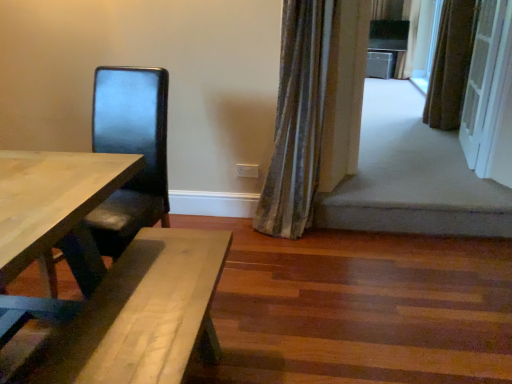
Question: Visually, is velvet-like curtain at upper right, which ranks as the third curtain in top-to-bottom order, positioned to the left or to the right of matte black chair at left?

Choices:
 (A) left
 (B) right

Answer: (B)

Question: In terms of width, does velvet-like curtain at upper right, the 3th curtain positioned from the right, look wider or thinner when compared to matte black chair at left?

Choices:
 (A) wide
 (B) thin

Answer: (B)

Question: Which is nearer to the striped fabric curtain at upper right, which is counted as the 1th curtain, starting from the right?

Choices:
 (A) brown textured curtain at upper right, which is the second curtain from top to bottom
 (B) white textured screen door at upper right
 (C) matte black chair at left
 (D) velvet-like curtain at upper right, acting as the 1th curtain starting from the bottom

Answer: (A)

Question: Based on their relative distances, which object is farther from the white textured screen door at upper right?

Choices:
 (A) striped fabric curtain at upper right, the 3th curtain when ordered from front to back
 (B) matte black chair at left
 (C) velvet-like curtain at upper right, the 1th curtain viewed from the left
 (D) brown textured curtain at upper right, which is the second curtain from top to bottom

Answer: (A)